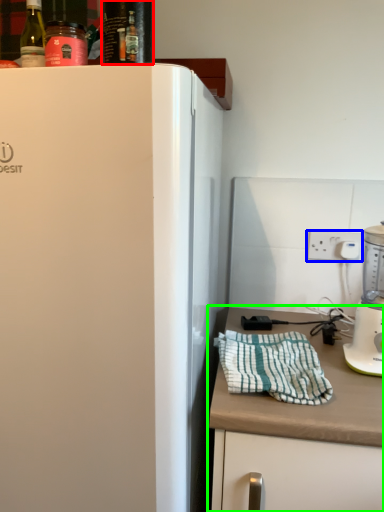
Question: Estimate the real-world distances between objects in this image. Which object is closer to beverage (highlighted by a red box), electric outlet (highlighted by a blue box) or countertop (highlighted by a green box)?

Choices:
 (A) electric outlet
 (B) countertop

Answer: (B)